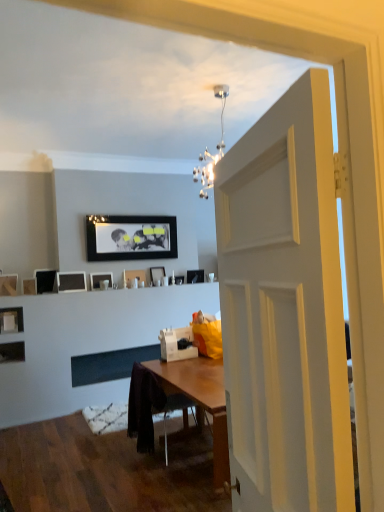
This screenshot has width=384, height=512. In order to click on free point below matte black picture frame at left, which ranks as the eleventh picture frame in right-to-left order (from a real-world perspective) in this screenshot , I will do `click(13, 417)`.